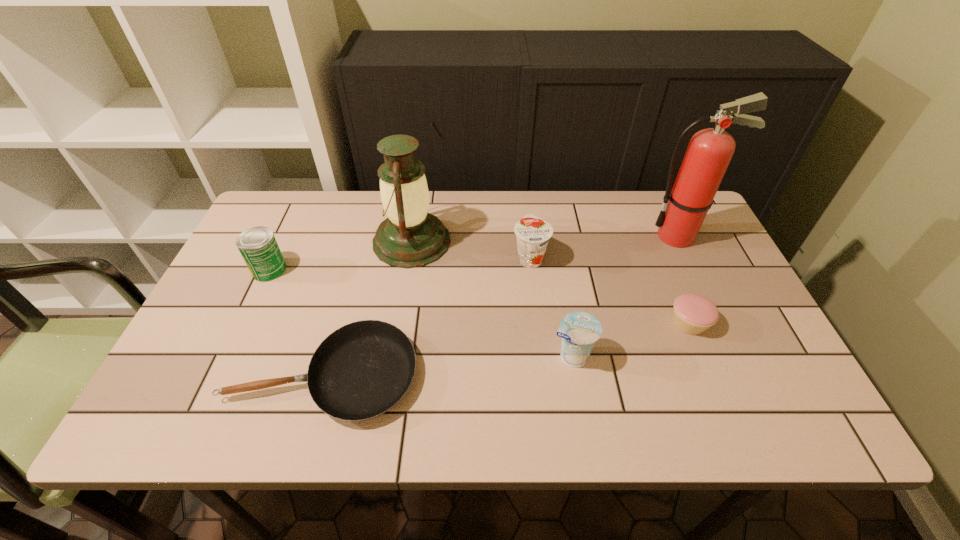
Select which object appears as the third closest to the fire extinguisher. Please provide its 2D coordinates. Your answer should be formatted as a tuple, i.e. [(x, y)], where the tuple contains the x and y coordinates of a point satisfying the conditions above.

[(579, 330)]

Identify which object is the closest to the second tallest object. Please provide its 2D coordinates. Your answer should be formatted as a tuple, i.e. [(x, y)], where the tuple contains the x and y coordinates of a point satisfying the conditions above.

[(532, 233)]

Image resolution: width=960 pixels, height=540 pixels. What are the coordinates of `free space that satisfies the following two spatial constraints: 1. on the front side of the can; 2. on the left side of the sixth tallest object` in the screenshot? It's located at (245, 323).

Locate an element on the screen. This screenshot has width=960, height=540. blank space that satisfies the following two spatial constraints: 1. with the light compartment facing forward on the sixth tallest object; 2. on the right side of the lantern is located at coordinates click(398, 323).

This screenshot has width=960, height=540. Identify the location of vacant space that satisfies the following two spatial constraints: 1. with the light compartment facing forward on the nearer yogurt; 2. on the left side of the lantern. (393, 356).

Image resolution: width=960 pixels, height=540 pixels. I want to click on vacant position in the image that satisfies the following two spatial constraints: 1. with the light compartment facing forward on the lantern; 2. on the left side of the farther yogurt, so click(409, 258).